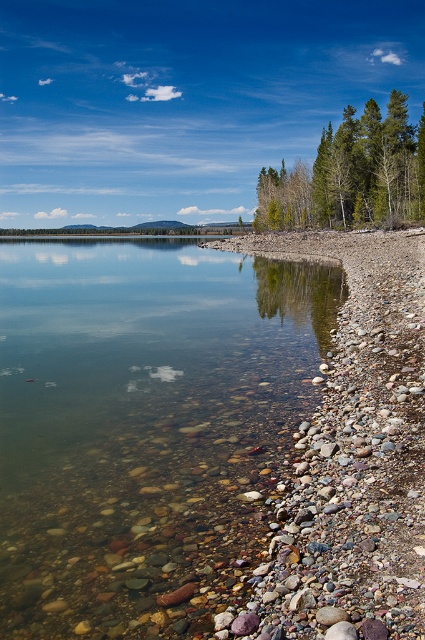
You are standing at the lakeside and looking towards the right bank. There are two points marked on the image, point 1 at coordinates [234,573] and point 2 at coordinates [399,118]. Which point is closer to your current position?

Point 1 at coordinates [234,573] is closer to your current position because it is closer to the camera than point 2 at coordinates [399,118].

You are standing on the lakeside and want to take a photo of the clear water at center and the green textured trees at upper right. Which object should you point your camera towards first if you want to capture both in a single frame without moving the camera?

You should point your camera towards the clear water at center first because it is located to the left of the green textured trees at upper right, allowing both objects to be captured in the same frame without moving the camera.